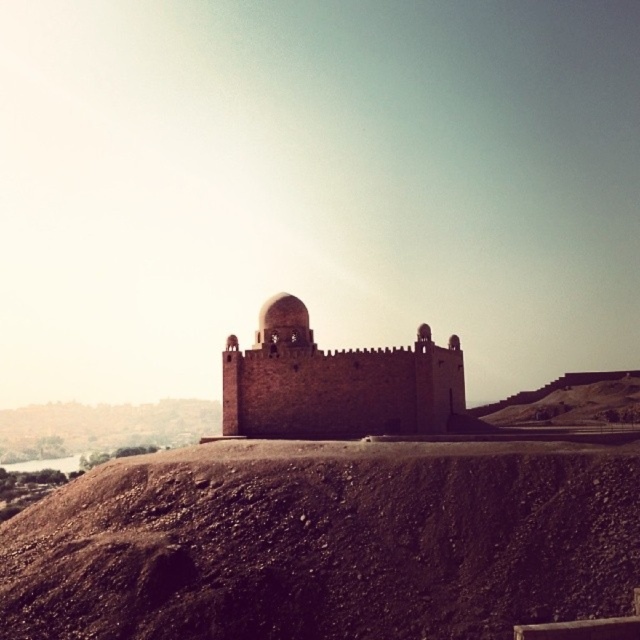
Is point (227, 632) in front of point (291, 320)?

Yes, point (227, 632) is closer to viewer.

Does brown dirt mound at center appear on the right side of matte stone dome at center?

Yes, brown dirt mound at center is to the right of matte stone dome at center.

Is point (417, 561) more distant than point (260, 314)?

No, it is in front of (260, 314).

You are a GUI agent. You are given a task and a screenshot of the screen. Output one action in this format:
    pyautogui.click(x=<x>, y=<y>)
    Task: Click on the brown dirt mound at center
    Image resolution: width=640 pixels, height=640 pixels.
    Given the screenshot: What is the action you would take?
    pyautogui.click(x=324, y=545)

How distant is brown dirt mound at center from brown stone fort at center?

brown dirt mound at center and brown stone fort at center are 20.83 meters apart from each other.

Does brown dirt mound at center appear under brown stone fort at center?

Indeed, brown dirt mound at center is positioned under brown stone fort at center.

Is point (378, 461) positioned before point (284, 422)?

Yes.

This screenshot has width=640, height=640. I want to click on brown dirt mound at center, so click(x=324, y=545).

Who is more forward, (394, 388) or (262, 342)?

Point (394, 388) is more forward.

Does point (412, 420) come farther from viewer compared to point (280, 321)?

No, it is not.

Where is `brown stone fort at center`? The width and height of the screenshot is (640, 640). brown stone fort at center is located at coordinates (336, 381).